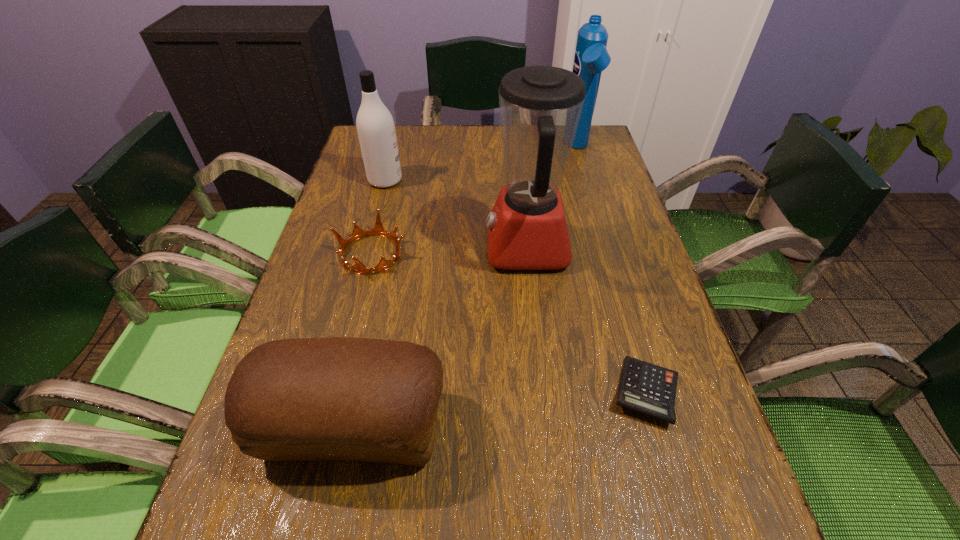
At what (x,y) coordinates should I click in order to perform the action: click on blender. Please return your answer as a coordinate pair (x, y). Image resolution: width=960 pixels, height=540 pixels. Looking at the image, I should click on (540, 106).

Where is `the right shampoo`? This screenshot has width=960, height=540. the right shampoo is located at coordinates (591, 57).

Find the location of `the farthest object`. the farthest object is located at coordinates (591, 57).

Locate an element on the screen. the nearer shampoo is located at coordinates (376, 131).

Locate an element on the screen. The width and height of the screenshot is (960, 540). the left shampoo is located at coordinates (376, 131).

Identify the location of the fourth tallest object. This screenshot has height=540, width=960. (339, 398).

Where is `the fifth tallest object`? This screenshot has height=540, width=960. the fifth tallest object is located at coordinates (378, 230).

Find the location of a particular element. calculator is located at coordinates (646, 388).

At what (x,y) coordinates should I click in order to perform the action: click on vacant space located 0.260m on the front of the blender near the controls. Please return your answer as a coordinate pair (x, y). The height and width of the screenshot is (540, 960). Looking at the image, I should click on (376, 248).

This screenshot has width=960, height=540. In order to click on vacant space located 0.110m on the front of the blender near the controls in this screenshot , I will do `click(440, 248)`.